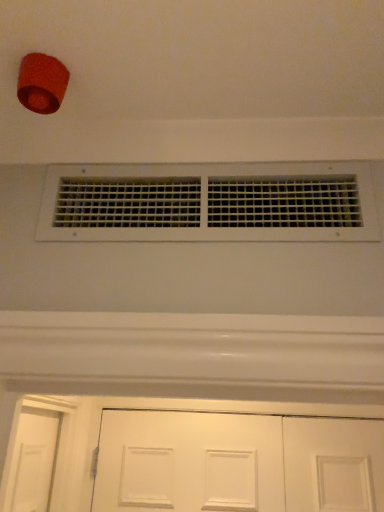
Question: Do you think white matte door at lower center is within white plastic vents at center, or outside of it?

Choices:
 (A) outside
 (B) inside

Answer: (A)

Question: From their relative heights in the image, would you say white matte door at lower center is taller or shorter than white plastic vents at center?

Choices:
 (A) short
 (B) tall

Answer: (B)

Question: From a real-world perspective, is white matte door at lower center physically located above or below white plastic vents at center?

Choices:
 (A) below
 (B) above

Answer: (A)

Question: Would you say white plastic vents at center is to the left or to the right of white matte door at lower center in the picture?

Choices:
 (A) left
 (B) right

Answer: (A)

Question: Which is correct: white plastic vents at center is inside white matte door at lower center, or outside of it?

Choices:
 (A) inside
 (B) outside

Answer: (B)

Question: From the image's perspective, is white plastic vents at center positioned above or below white matte door at lower center?

Choices:
 (A) below
 (B) above

Answer: (B)

Question: In terms of size, does white plastic vents at center appear bigger or smaller than white matte door at lower center?

Choices:
 (A) small
 (B) big

Answer: (A)